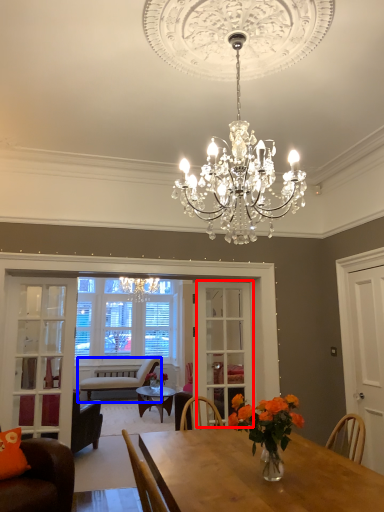
Question: Which object appears closest to the camera in this image, glass door (highlighted by a red box) or chair (highlighted by a blue box)?

Choices:
 (A) glass door
 (B) chair

Answer: (A)